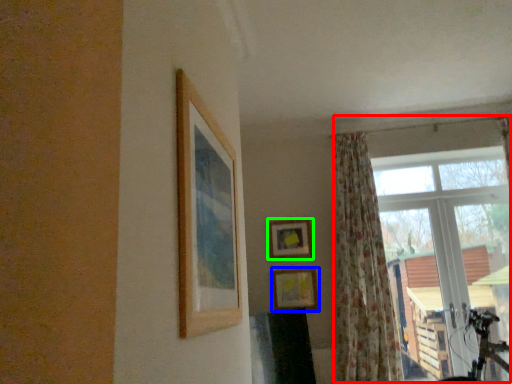
Question: Considering the real-world distances, which object is farthest from window (highlighted by a red box)? picture frame (highlighted by a blue box) or picture frame (highlighted by a green box)?

Choices:
 (A) picture frame
 (B) picture frame

Answer: (A)